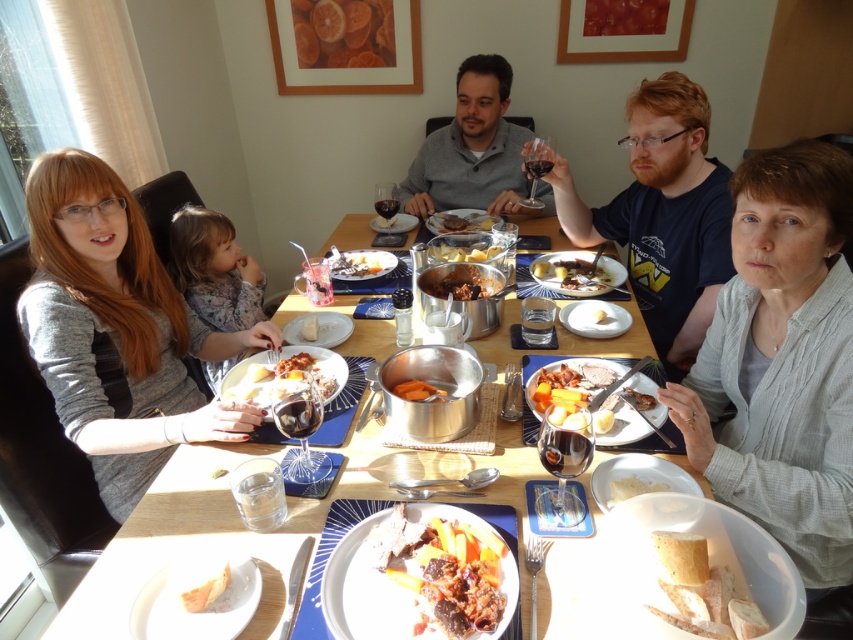
Question: Does white matte plate at lower left have a smaller size compared to smooth orange carrot at center?

Choices:
 (A) yes
 (B) no

Answer: (A)

Question: Considering the real-world distances, which object is closest to the brown matte stew at center?

Choices:
 (A) meat stew with vegetables at center
 (B) smooth brown gravy at center

Answer: (B)

Question: From the image, what is the correct spatial relationship of smooth brown gravy at center in relation to white creamy bread at lower right?

Choices:
 (A) above
 (B) below

Answer: (A)

Question: Among these points, which one is farthest from the camera?

Choices:
 (A) (358, 266)
 (B) (112, 460)
 (C) (431, 216)

Answer: (C)

Question: Among these objects, which one is nearest to the camera?

Choices:
 (A) slightly browned meat at center
 (B) matte gray sweater at center
 (C) golden brown bread at center

Answer: (C)

Question: Is golden brown bread at center bigger than slightly browned meat at center?

Choices:
 (A) yes
 (B) no

Answer: (A)